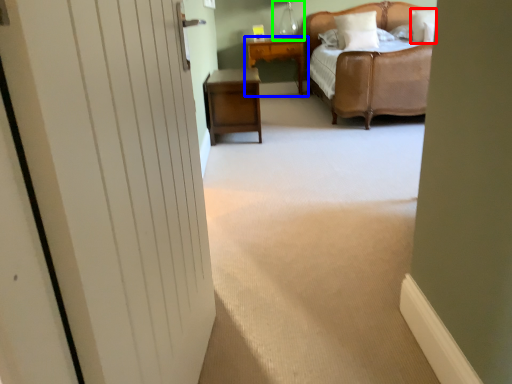
Question: Which object is positioned closest to pillow (highlighted by a red box)? Select from nightstand (highlighted by a blue box) and table lamp (highlighted by a green box).

Choices:
 (A) nightstand
 (B) table lamp

Answer: (A)